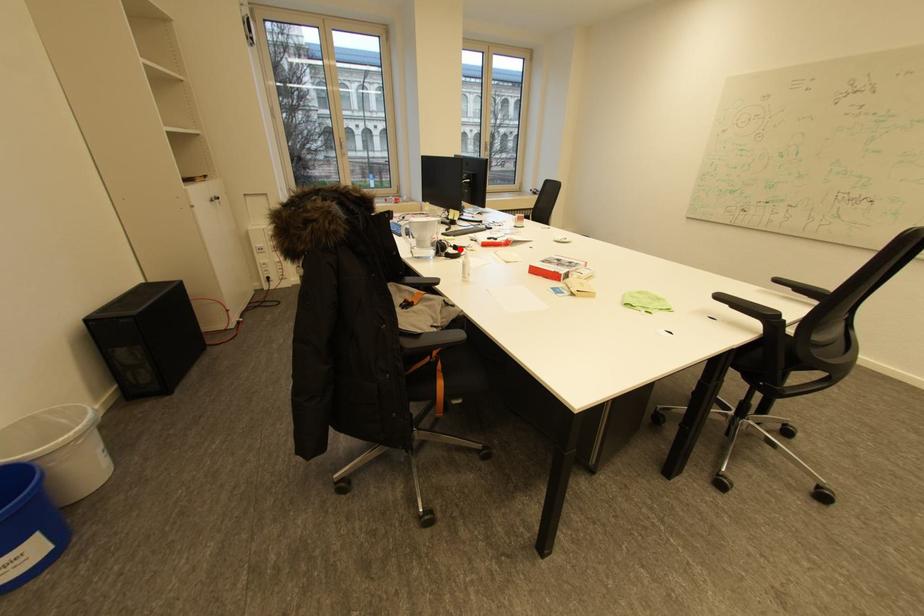
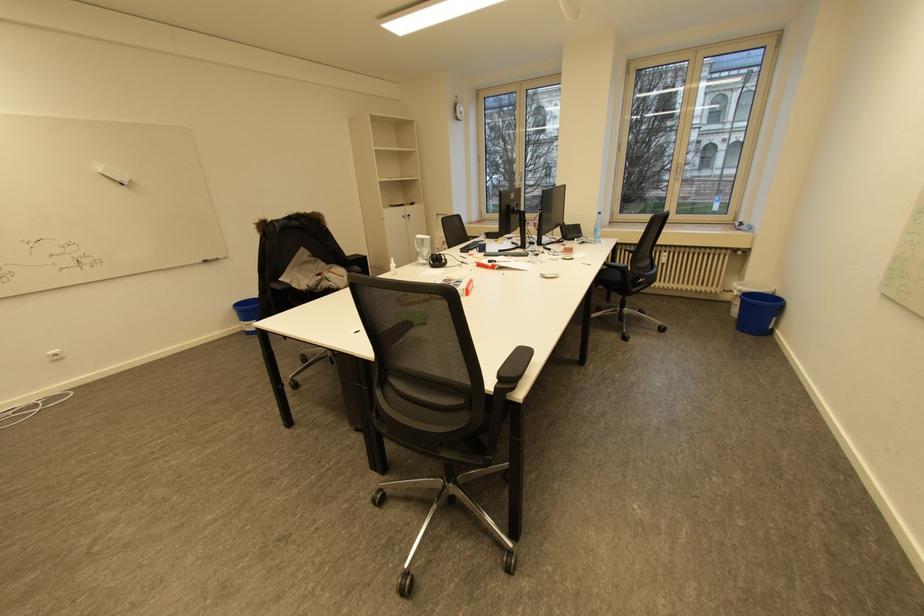
Question: I am providing you with two images of the same scene from different viewpoints. A red point is marked on the first image. Can you still see the location of the red point in image 2?

Choices:
 (A) Yes
 (B) No

Answer: (B)